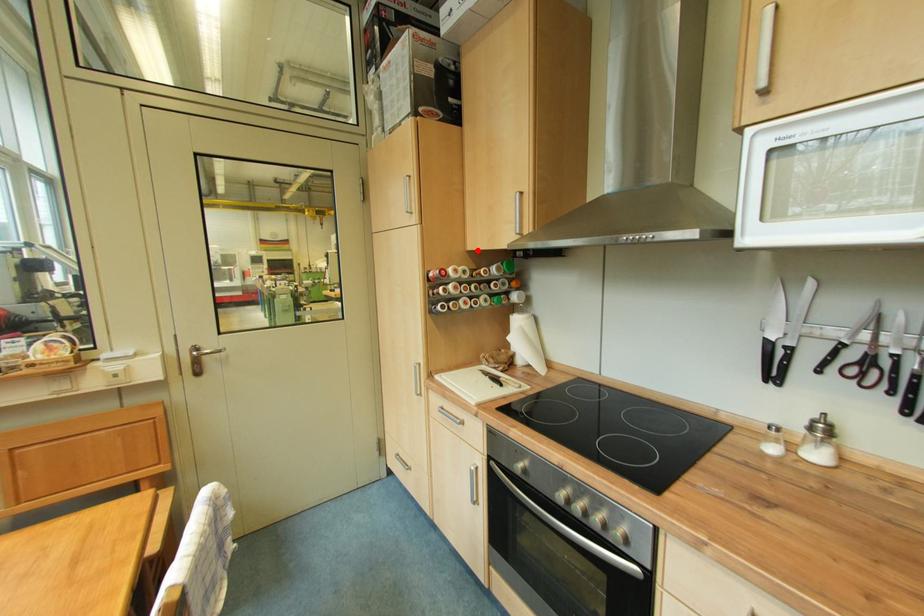
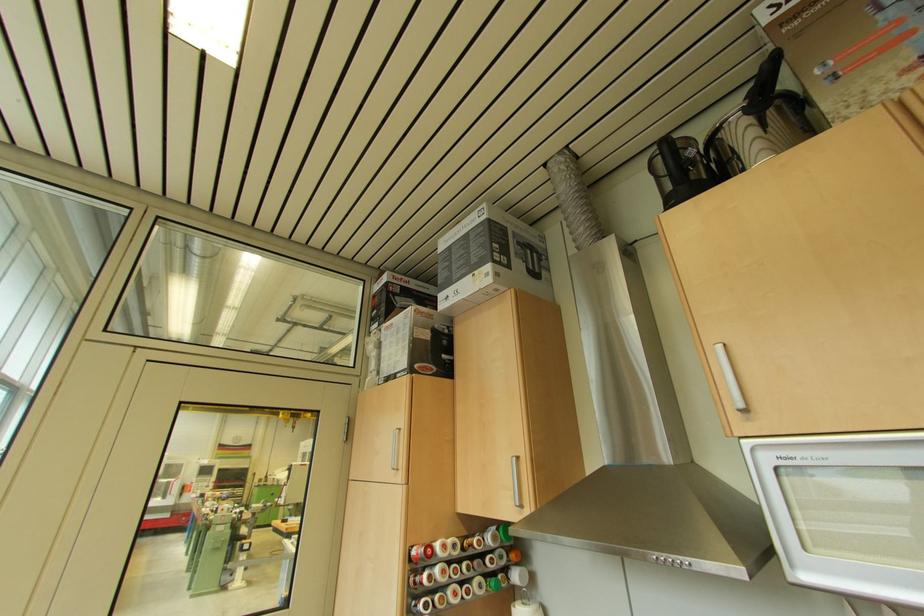
Locate, in the second image, the point that corresponds to the highlighted location in the first image.

(468, 513)